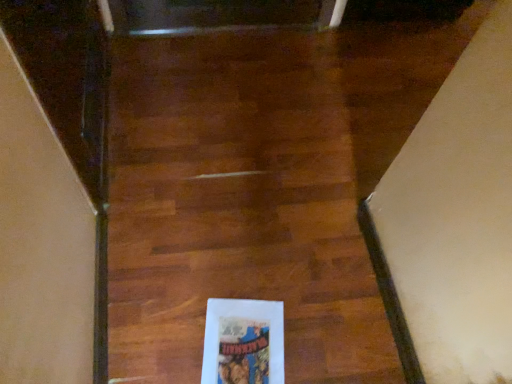
Question: Should I look upward or downward to see wooden floor at center?

Choices:
 (A) down
 (B) up

Answer: (B)